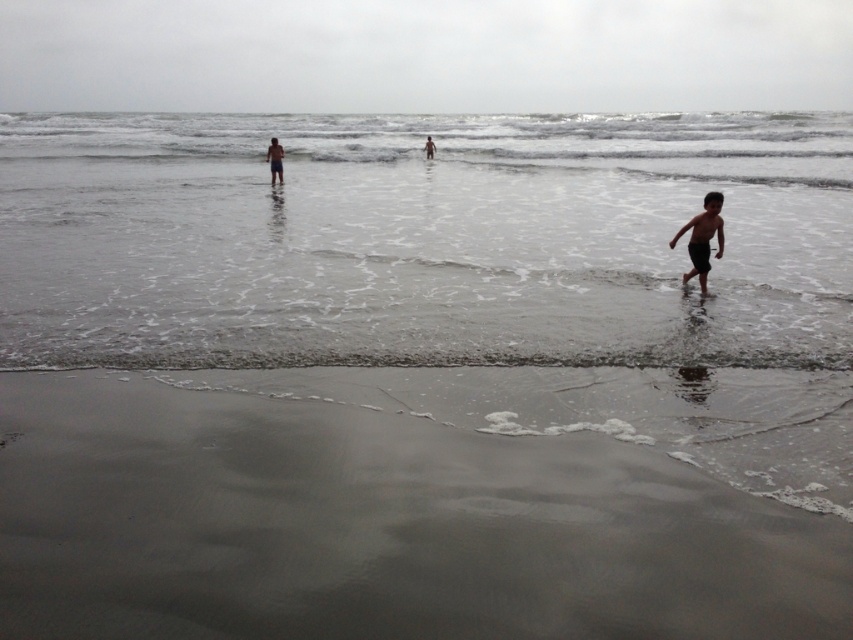
Can you confirm if black matte shorts at lower right is bigger than dark skin human at center?

No, black matte shorts at lower right is not bigger than dark skin human at center.

This screenshot has height=640, width=853. What do you see at coordinates (701, 237) in the screenshot? I see `black matte shorts at lower right` at bounding box center [701, 237].

Locate an element on the screen. The image size is (853, 640). black matte shorts at lower right is located at coordinates (701, 237).

Locate an element on the screen. The width and height of the screenshot is (853, 640). clear water at center is located at coordinates (421, 237).

Is clear water at center thinner than smooth skin human at center?

In fact, clear water at center might be wider than smooth skin human at center.

Is point (759, 125) positioned before point (271, 172)?

No, it is not.

The width and height of the screenshot is (853, 640). Find the location of `clear water at center`. clear water at center is located at coordinates (421, 237).

Does clear water at center come behind sandy beach at lower left?

Yes, it is behind sandy beach at lower left.

Which is more to the left, clear water at center or sandy beach at lower left?

clear water at center is more to the left.

Which is behind, point (712, 140) or point (4, 634)?

Point (712, 140)

The width and height of the screenshot is (853, 640). What are the coordinates of `clear water at center` in the screenshot? It's located at (421, 237).